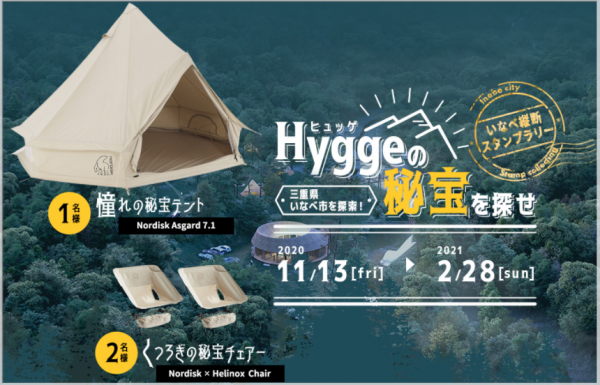
This screenshot has height=385, width=600. Identify the location of chair. (131, 286), (211, 287).